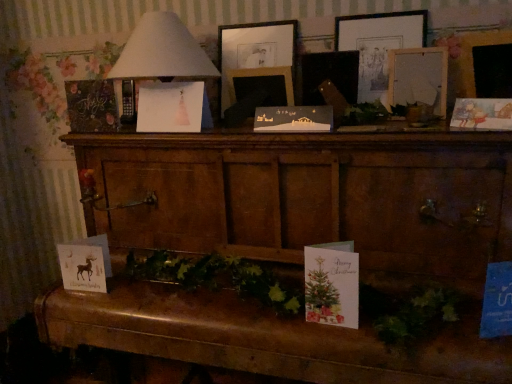
From the picture: Measure the distance between point (148, 93) and camera.

Point (148, 93) is 4.24 feet away from camera.

The width and height of the screenshot is (512, 384). What are the coordinates of `white paper christmas card at center, arranged as the 2th christmas card when viewed from the right` in the screenshot? It's located at (294, 119).

What is the approximate height of wooden picture frame at upper center, the 1th picture frame from the right?

wooden picture frame at upper center, the 1th picture frame from the right, is 12.72 inches tall.

The width and height of the screenshot is (512, 384). Find the location of `white paper lampshade at upper left`. white paper lampshade at upper left is located at coordinates coord(162,51).

This screenshot has height=384, width=512. Find the location of `matte black picture frame at center, the second picture frame when ordered from right to left`. matte black picture frame at center, the second picture frame when ordered from right to left is located at coordinates (330, 75).

Measure the distance between matte black picture frame at center, marked as the 3th picture frame in a right-to-left arrangement, and camera.

matte black picture frame at center, marked as the 3th picture frame in a right-to-left arrangement, is 1.21 meters away from camera.

Locate an element on the screen. pink paper christmas card at center, arranged as the third christmas card when viewed from the right is located at coordinates (170, 107).

Who is smaller, chalkboard paper at left, arranged as the 5th christmas card when ordered from the bottom, or white paper christmas card at center, which appears as the third christmas card when ordered from the bottom?

white paper christmas card at center, which appears as the third christmas card when ordered from the bottom, is smaller.

From a real-world perspective, who is located higher, chalkboard paper at left, the fifth christmas card when ordered from right to left, or white paper christmas card at center, arranged as the 2th christmas card when viewed from the right?

In real-world perspective, chalkboard paper at left, the fifth christmas card when ordered from right to left, is above.

Does point (80, 116) come closer to viewer compared to point (272, 119)?

No, it is not.

Between chalkboard paper at left, the 1th christmas card viewed from the left, and white paper christmas card at center, arranged as the 2th christmas card when viewed from the right, which one is positioned in front?

white paper christmas card at center, arranged as the 2th christmas card when viewed from the right.

From a real-world perspective, is matte gold card with reindeer at lower left, the 2th christmas card from the left, on top of chalkboard paper at left, arranged as the 5th christmas card when ordered from the bottom?

No, from a real-world perspective, matte gold card with reindeer at lower left, the 2th christmas card from the left, is not on top of chalkboard paper at left, arranged as the 5th christmas card when ordered from the bottom.

Is matte gold card with reindeer at lower left, the 4th christmas card viewed from the right, not close to chalkboard paper at left, the 1th christmas card viewed from the left?

That's not correct — matte gold card with reindeer at lower left, the 4th christmas card viewed from the right, is a little close to chalkboard paper at left, the 1th christmas card viewed from the left.

How much distance is there between matte gold card with reindeer at lower left, arranged as the fifth christmas card when viewed from the top, and chalkboard paper at left, placed as the first christmas card when sorted from top to bottom?

The distance of matte gold card with reindeer at lower left, arranged as the fifth christmas card when viewed from the top, from chalkboard paper at left, placed as the first christmas card when sorted from top to bottom, is 16.97 inches.

Which point is more forward, (80, 267) or (105, 111)?

The point (80, 267) is closer to the camera.

Considering the relative sizes of wooden chest at center and matte black picture frame at center, which is the 2th picture frame from left to right, in the image provided, is wooden chest at center wider than matte black picture frame at center, which is the 2th picture frame from left to right,?

Indeed, wooden chest at center has a greater width compared to matte black picture frame at center, which is the 2th picture frame from left to right.

Is there a large distance between wooden chest at center and matte black picture frame at center, marked as the 3th picture frame in a right-to-left arrangement?

No, wooden chest at center is in close proximity to matte black picture frame at center, marked as the 3th picture frame in a right-to-left arrangement.

Can you tell me how much wooden chest at center and matte black picture frame at center, which is the 2th picture frame from left to right, differ in facing direction?

4.87 degrees.

Looking at this image, from the image's perspective, is wooden chest at center on matte black picture frame at center, which is the 2th picture frame from left to right?

No, from the image's perspective, wooden chest at center is not above matte black picture frame at center, which is the 2th picture frame from left to right.

From a real-world perspective, is wooden picture frame at upper center, which ranks as the 1th picture frame in left-to-right order, positioned over wooden picture frame at upper center, the 4th picture frame from the left, based on gravity?

Yes, from a real-world perspective, wooden picture frame at upper center, which ranks as the 1th picture frame in left-to-right order, is above wooden picture frame at upper center, the 4th picture frame from the left.

Does wooden picture frame at upper center, which ranks as the 1th picture frame in left-to-right order, have a greater height compared to wooden picture frame at upper center, the 1th picture frame from the right?

In fact, wooden picture frame at upper center, which ranks as the 1th picture frame in left-to-right order, may be shorter than wooden picture frame at upper center, the 1th picture frame from the right.

From the image's perspective, is wooden picture frame at upper center, marked as the fourth picture frame in a right-to-left arrangement, over wooden picture frame at upper center, the 1th picture frame from the right?

Yes, from the image's perspective, wooden picture frame at upper center, marked as the fourth picture frame in a right-to-left arrangement, is on top of wooden picture frame at upper center, the 1th picture frame from the right.

Would you consider wooden picture frame at upper center, which ranks as the 1th picture frame in left-to-right order, to be distant from wooden picture frame at upper center, the 4th picture frame from the left?

No, there isn't a large distance between wooden picture frame at upper center, which ranks as the 1th picture frame in left-to-right order, and wooden picture frame at upper center, the 4th picture frame from the left.

Does matte paper card at right, the 4th christmas card from the top, turn towards matte gold card with reindeer at lower left, the 2th christmas card from the left?

No, matte paper card at right, the 4th christmas card from the top, is not facing towards matte gold card with reindeer at lower left, the 2th christmas card from the left.

Could you measure the distance between matte paper card at right, the 4th christmas card from the top, and matte gold card with reindeer at lower left, arranged as the fifth christmas card when viewed from the top?

A distance of 3.54 feet exists between matte paper card at right, the 4th christmas card from the top, and matte gold card with reindeer at lower left, arranged as the fifth christmas card when viewed from the top.

From the image's perspective, which is below, matte paper card at right, the 4th christmas card from the top, or matte gold card with reindeer at lower left, which appears as the 1th christmas card when ordered from the bottom?

matte gold card with reindeer at lower left, which appears as the 1th christmas card when ordered from the bottom, from the image's perspective.

Would you say matte paper card at right, the 2th christmas card from the bottom, is a long distance from matte gold card with reindeer at lower left, which appears as the 1th christmas card when ordered from the bottom?

Yes.

From the image's perspective, is chalkboard paper at left, placed as the first christmas card when sorted from top to bottom, positioned above or below matte black picture frame at center, the third picture frame when ordered from left to right?

Clearly, from the image's perspective, chalkboard paper at left, placed as the first christmas card when sorted from top to bottom, is below matte black picture frame at center, the third picture frame when ordered from left to right.

Do you think chalkboard paper at left, arranged as the 5th christmas card when ordered from the bottom, is within matte black picture frame at center, the third picture frame when ordered from left to right, or outside of it?

chalkboard paper at left, arranged as the 5th christmas card when ordered from the bottom, is not inside matte black picture frame at center, the third picture frame when ordered from left to right, it's outside.

Between chalkboard paper at left, the fifth christmas card when ordered from right to left, and matte black picture frame at center, the third picture frame when ordered from left to right, which one has smaller size?

chalkboard paper at left, the fifth christmas card when ordered from right to left.

Is chalkboard paper at left, the fifth christmas card when ordered from right to left, far from matte black picture frame at center, the second picture frame when ordered from right to left?

That's not correct — chalkboard paper at left, the fifth christmas card when ordered from right to left, is a little close to matte black picture frame at center, the second picture frame when ordered from right to left.

The width and height of the screenshot is (512, 384). Find the location of `table lamp that appears above the matte black picture frame at center, which is the 2th picture frame from left to right (from a real-world perspective)`. table lamp that appears above the matte black picture frame at center, which is the 2th picture frame from left to right (from a real-world perspective) is located at coordinates (162, 51).

From the picture: Is white paper lampshade at upper left positioned behind matte black picture frame at center, which is the 2th picture frame from left to right?

No, it is not.

From the picture: Considering the positions of objects white paper lampshade at upper left and matte black picture frame at center, marked as the 3th picture frame in a right-to-left arrangement, in the image provided, who is more to the left, white paper lampshade at upper left or matte black picture frame at center, marked as the 3th picture frame in a right-to-left arrangement,?

white paper lampshade at upper left is more to the left.

Can we say white paper lampshade at upper left lies outside matte black picture frame at center, which is the 2th picture frame from left to right?

Indeed, white paper lampshade at upper left is completely outside matte black picture frame at center, which is the 2th picture frame from left to right.

At what (x,y) coordinates should I click in order to perform the action: click on the 2nd christmas card above the white paper christmas card at center, the 4th christmas card viewed from the left (from the image's perspective). Please return your answer as a coordinate pair (x, y). Looking at the image, I should click on (91, 106).

Where is `christmas card on the left of matte gold card with reindeer at lower left, which appears as the 1th christmas card when ordered from the bottom`? christmas card on the left of matte gold card with reindeer at lower left, which appears as the 1th christmas card when ordered from the bottom is located at coordinates (91, 106).

Considering their positions, is wooden picture frame at upper center, the 1th picture frame from the right, positioned further to chalkboard paper at left, the fifth christmas card when ordered from right to left, than wooden picture frame at upper center, which ranks as the 1th picture frame in left-to-right order?

wooden picture frame at upper center, the 1th picture frame from the right, is positioned further to the anchor chalkboard paper at left, the fifth christmas card when ordered from right to left.

Based on their spatial positions, is matte gold card with reindeer at lower left, the 2th christmas card from the left, or white paper lampshade at upper left closer to matte black picture frame at center, the third picture frame when ordered from left to right?

white paper lampshade at upper left lies closer to matte black picture frame at center, the third picture frame when ordered from left to right, than the other object.

From the picture: Estimate the real-world distances between objects in this image. Which object is further from matte gold card with reindeer at lower left, arranged as the fifth christmas card when viewed from the top, wooden chest at center or wooden picture frame at upper center, which ranks as the 1th picture frame in left-to-right order?

wooden picture frame at upper center, which ranks as the 1th picture frame in left-to-right order, is further to matte gold card with reindeer at lower left, arranged as the fifth christmas card when viewed from the top.

Estimate the real-world distances between objects in this image. Which object is further from chalkboard paper at left, placed as the first christmas card when sorted from top to bottom, wooden picture frame at upper center, which ranks as the 1th picture frame in left-to-right order, or matte paper card at right, the 2th christmas card from the bottom?

matte paper card at right, the 2th christmas card from the bottom, is positioned further to the anchor chalkboard paper at left, placed as the first christmas card when sorted from top to bottom.

Which object lies further to the anchor point matte paper card at right, which ranks as the fifth christmas card in left-to-right order, wooden picture frame at upper center, the 1th picture frame from the right, or chalkboard paper at left, the fifth christmas card when ordered from right to left?

The object further to matte paper card at right, which ranks as the fifth christmas card in left-to-right order, is chalkboard paper at left, the fifth christmas card when ordered from right to left.

Estimate the real-world distances between objects in this image. Which object is further from pink paper christmas card at center, arranged as the third christmas card when viewed from the right, wooden picture frame at upper center, which ranks as the 1th picture frame in left-to-right order, or wooden picture frame at upper center, the 1th picture frame from the right?

wooden picture frame at upper center, the 1th picture frame from the right, is further to pink paper christmas card at center, arranged as the third christmas card when viewed from the right.

Looking at this image, from the image, which object appears to be farther from white paper lampshade at upper left, wooden picture frame at upper center, the 4th picture frame from the left, or matte black picture frame at center, which is the 2th picture frame from left to right?

Based on the image, wooden picture frame at upper center, the 4th picture frame from the left, appears to be further to white paper lampshade at upper left.

Estimate the real-world distances between objects in this image. Which object is closer to wooden picture frame at upper center, the 4th picture frame from the left, white paper christmas card at center, which appears as the third christmas card when ordered from the bottom, or wooden chest at center?

white paper christmas card at center, which appears as the third christmas card when ordered from the bottom, is positioned closer to the anchor wooden picture frame at upper center, the 4th picture frame from the left.

I want to click on table lamp between chalkboard paper at left, the fifth christmas card when ordered from right to left, and matte black picture frame at center, which is the 2th picture frame from left to right, from left to right, so click(162, 51).

Where is `furniture located between matte gold card with reindeer at lower left, the 4th christmas card viewed from the right, and matte paper card at right, the 4th christmas card from the top, in the left-right direction`? furniture located between matte gold card with reindeer at lower left, the 4th christmas card viewed from the right, and matte paper card at right, the 4th christmas card from the top, in the left-right direction is located at coordinates [295, 245].

Locate an element on the screen. The width and height of the screenshot is (512, 384). table lamp located between matte gold card with reindeer at lower left, arranged as the fifth christmas card when viewed from the top, and wooden picture frame at upper center, the 4th picture frame from the left, in the left-right direction is located at coordinates (162, 51).

Where is `table lamp between chalkboard paper at left, the fifth christmas card when ordered from right to left, and matte paper card at right, the 2th christmas card from the bottom, from left to right`? This screenshot has height=384, width=512. table lamp between chalkboard paper at left, the fifth christmas card when ordered from right to left, and matte paper card at right, the 2th christmas card from the bottom, from left to right is located at coordinates (162, 51).